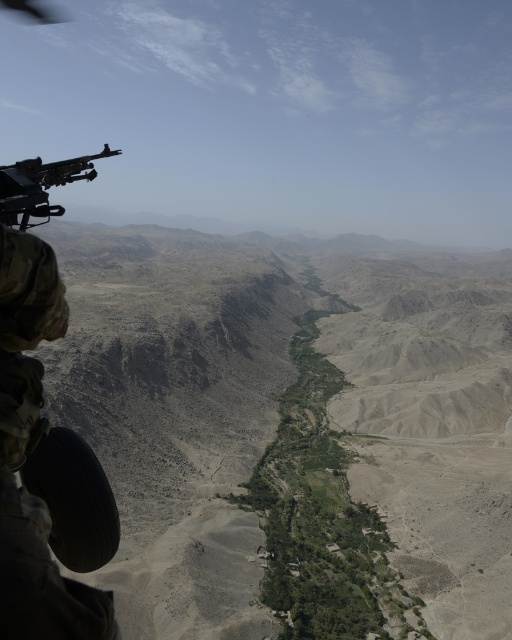
Question: Is camouflage fabric helmet at left closer to camera compared to polished metal machine gun at upper left?

Choices:
 (A) no
 (B) yes

Answer: (B)

Question: Does camouflage fabric helmet at left appear over polished metal machine gun at upper left?

Choices:
 (A) yes
 (B) no

Answer: (B)

Question: Which point is closer to the camera?

Choices:
 (A) camouflage fabric helmet at left
 (B) polished metal machine gun at upper left

Answer: (A)

Question: Among these points, which one is nearest to the camera?

Choices:
 (A) pyautogui.click(x=19, y=304)
 (B) pyautogui.click(x=10, y=208)

Answer: (A)

Question: Does camouflage fabric helmet at left have a lesser width compared to polished metal machine gun at upper left?

Choices:
 (A) yes
 (B) no

Answer: (A)